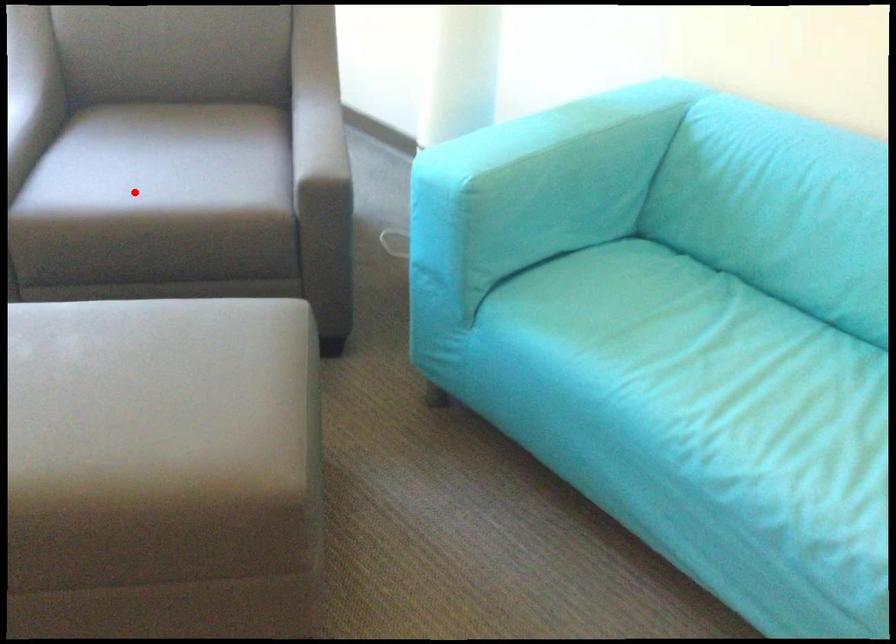
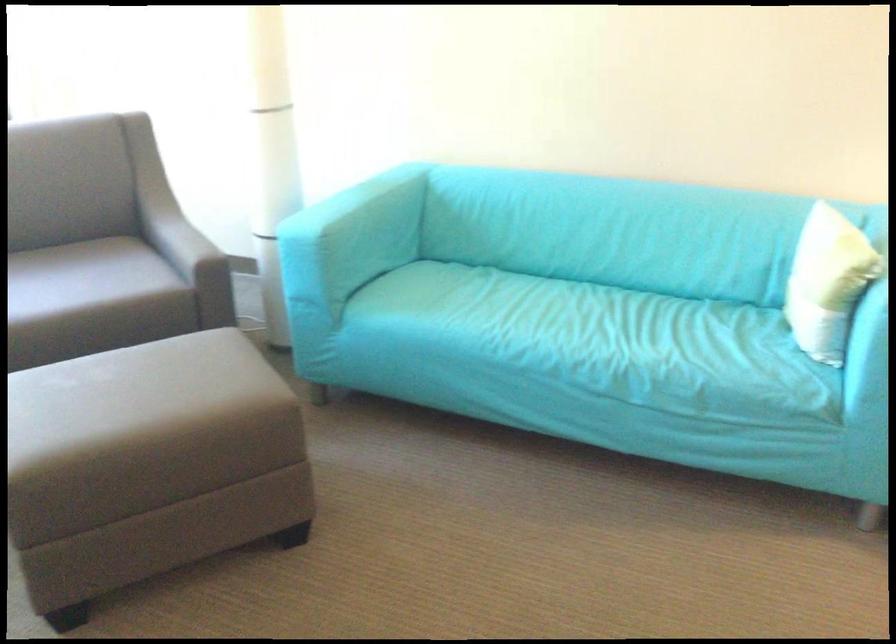
Locate, in the second image, the point that corresponds to the highlighted location in the first image.

(53, 298)